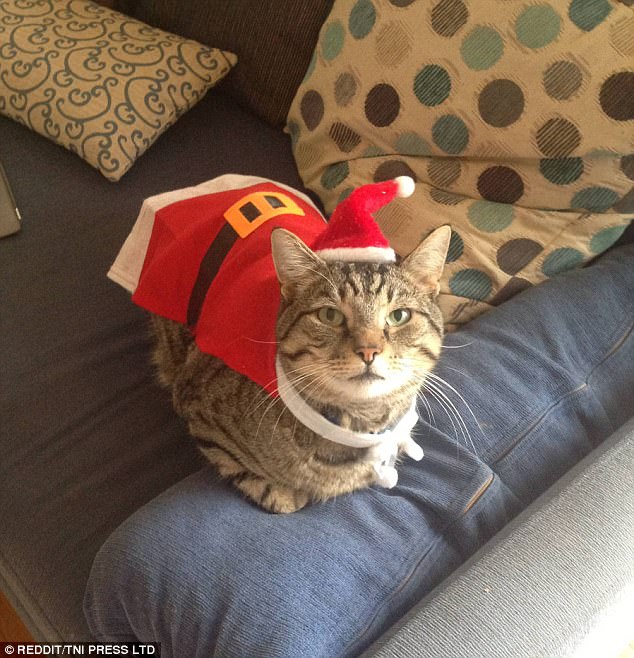
This screenshot has width=634, height=658. In order to click on zipper in  pillow arm in this screenshot , I will do `click(477, 484)`.